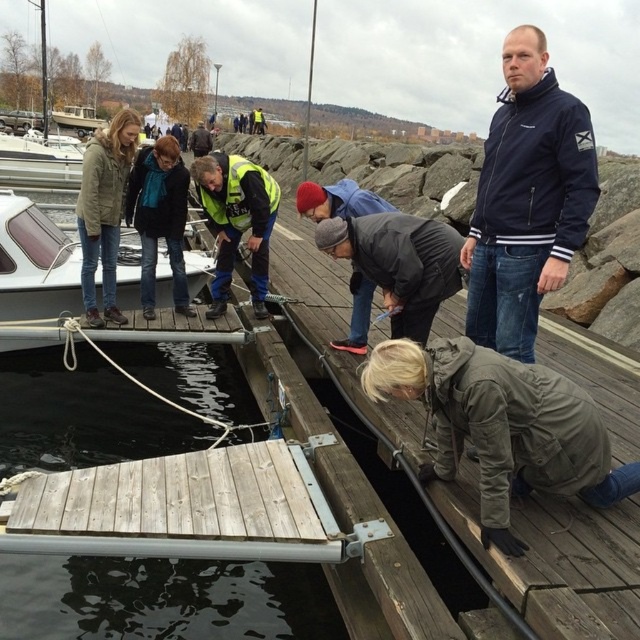
You are a visitor at the dock and want to locate the white glossy boat at upper left and the white glossy boat at left. According to the scene, which boat is positioned to the right of the other?

The white glossy boat at upper left is positioned on the right side of white glossy boat at left.

Looking at this image, you are standing on the dock and want to place a heavy tool on the ground near the gray matte jacket at lower right. Is the dark wood water at lower left a suitable location for placing the tool?

The dark wood water at lower left is located below gray matte jacket at lower right. Since water cannot support heavy objects, placing the tool there would not be suitable.

You are standing on the dock and want to reach both the point at (60, 454) and the point at (502, 452). Which point should you reach first if you want to minimize the distance walked?

You should reach point (60, 454) first because it is closer to you than point (502, 452) since it is further away.